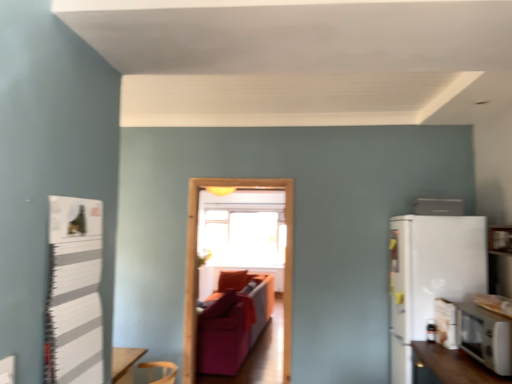
Question: Would you say white glossy microwave at lower right, the 1th appliance in the front-to-back sequence, is to the left or to the right of velvet red couch at center in the picture?

Choices:
 (A) right
 (B) left

Answer: (A)

Question: Is point pos(486,349) closer or farther from the camera than point pos(261,299)?

Choices:
 (A) farther
 (B) closer

Answer: (B)

Question: Considering the real-world distances, which object is closest to the transparent glass window screen at center?

Choices:
 (A) transparent glass door at center
 (B) white matte refrigerator at right
 (C) white glossy refrigerator at upper right, placed as the second appliance when sorted from front to back
 (D) white glossy microwave at lower right, the first appliance in the bottom-to-top sequence
 (E) white striped bulletin board at left

Answer: (A)

Question: Considering the real-world distances, which object is farthest from the white glossy microwave at lower right, the 2th appliance from the top?

Choices:
 (A) white matte refrigerator at right
 (B) transparent glass door at center
 (C) white striped bulletin board at left
 (D) velvet red couch at center
 (E) transparent glass window screen at center

Answer: (E)